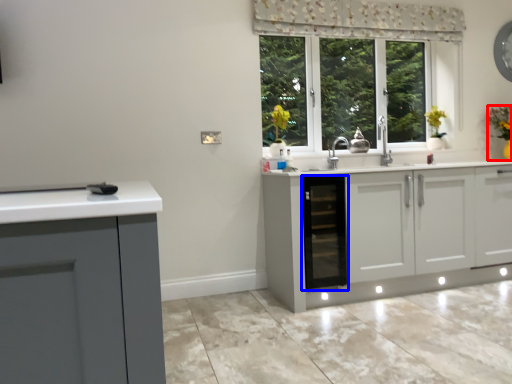
Question: Which point is closer to the camera, houseplant (highlighted by a red box) or dish washer (highlighted by a blue box)?

Choices:
 (A) houseplant
 (B) dish washer

Answer: (B)